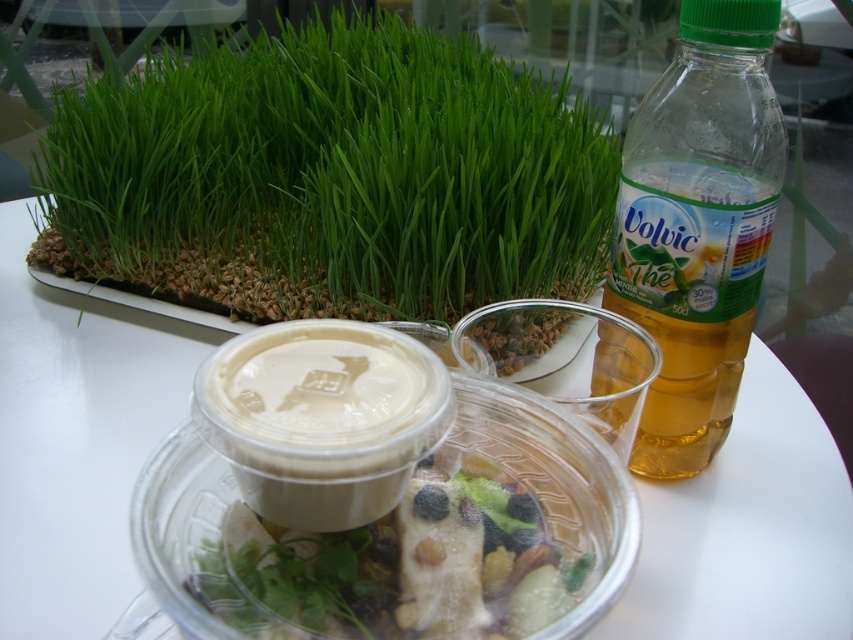
What is located at the point with coordinates (331, 177) on the image?

The point with coordinates (331, 177) marks green grass at upper left.

You are looking at the table setting described. There are two points marked on the image, point (224,141) and point (370,627). Which point is closer to you?

Point (224,141) is further to the camera than point (370,627), so the point closer to you is point (370,627).

Based on the photo, you are at a picnic and need to choose a container to hold a drink. You have the translucent plastic bottle at right and the translucent plastic salad at center. Which container is taller and better suited for holding a liquid?

The translucent plastic bottle at right is taller than the translucent plastic salad at center, so it is better suited for holding a liquid.